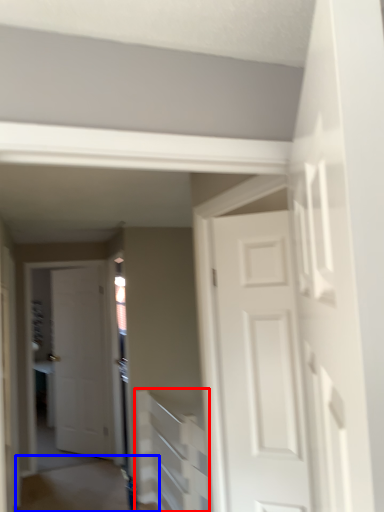
Question: Which point is closer to the camera, stairwell (highlighted by a red box) or path (highlighted by a blue box)?

Choices:
 (A) stairwell
 (B) path

Answer: (A)